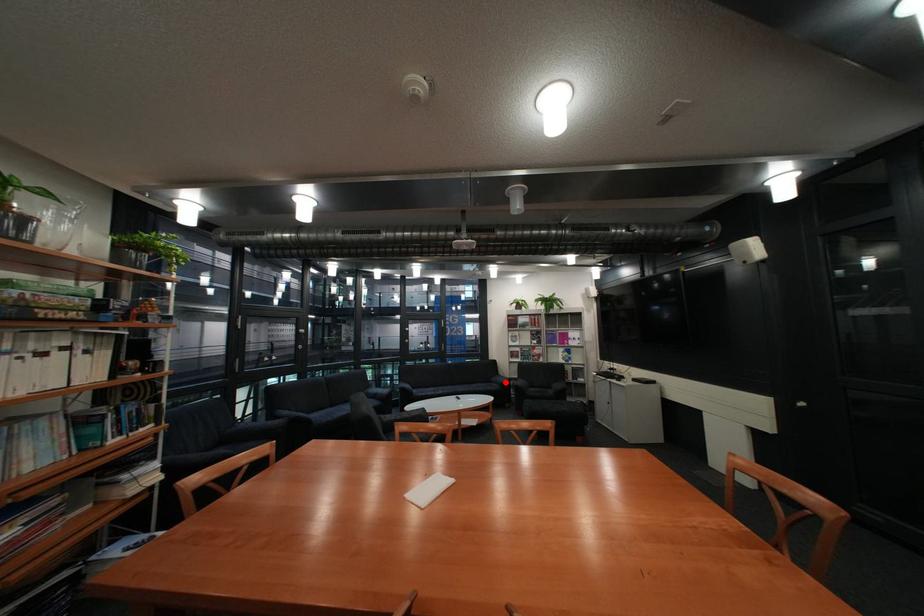
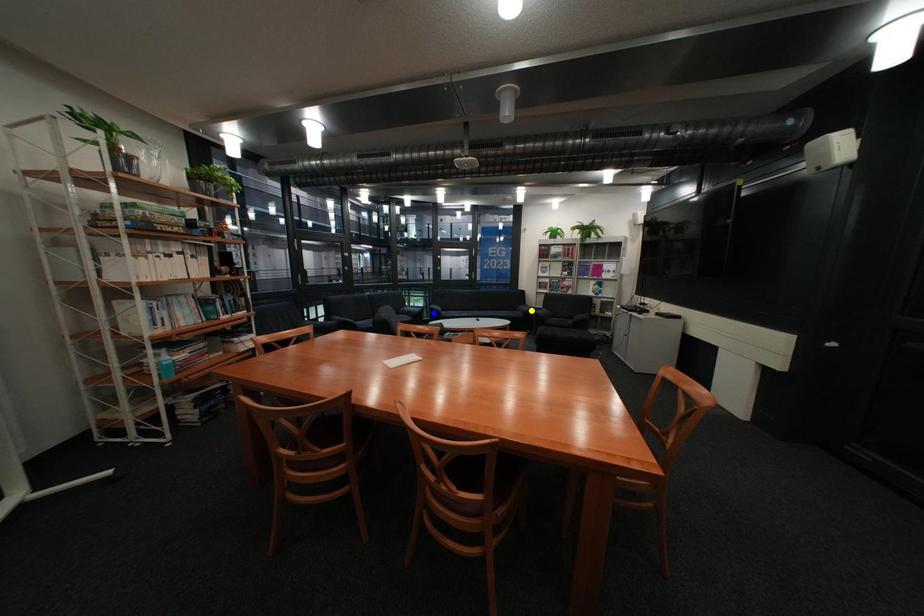
Question: I am providing you with two images of the same scene from different viewpoints. A red point is marked on the first image. You are given multiple points on the second image. In image 2, which mark is for the same physical point as the one in image 1?

Choices:
 (A) green point
 (B) blue point
 (C) yellow point

Answer: (C)